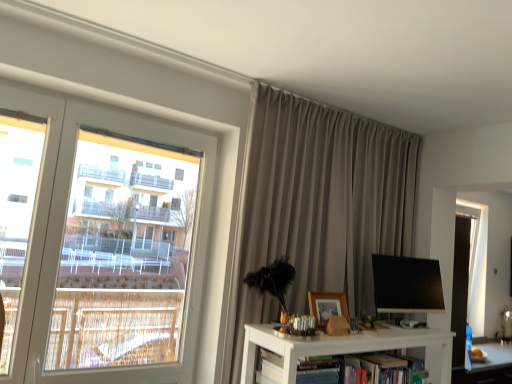
Question: Is matte gray curtain at upper center next to black glossy monitor at center and touching it?

Choices:
 (A) yes
 (B) no

Answer: (B)

Question: From a real-world perspective, does matte gray curtain at upper center sit lower than black glossy monitor at center?

Choices:
 (A) no
 (B) yes

Answer: (A)

Question: Would you say matte gray curtain at upper center is outside black glossy monitor at center?

Choices:
 (A) yes
 (B) no

Answer: (A)

Question: Considering the relative sizes of matte gray curtain at upper center and black glossy monitor at center in the image provided, is matte gray curtain at upper center taller than black glossy monitor at center?

Choices:
 (A) yes
 (B) no

Answer: (A)

Question: From a real-world perspective, does matte gray curtain at upper center stand above black glossy monitor at center?

Choices:
 (A) no
 (B) yes

Answer: (B)

Question: In terms of width, does hardcover book at center look wider or thinner when compared to wooden picture frame at center?

Choices:
 (A) thin
 (B) wide

Answer: (B)

Question: Would you say hardcover book at center is to the left or to the right of wooden picture frame at center in the picture?

Choices:
 (A) left
 (B) right

Answer: (B)

Question: Is hardcover book at center taller or shorter than wooden picture frame at center?

Choices:
 (A) short
 (B) tall

Answer: (B)

Question: Considering the positions of hardcover book at center and wooden picture frame at center in the image, is hardcover book at center bigger or smaller than wooden picture frame at center?

Choices:
 (A) big
 (B) small

Answer: (A)

Question: From the image's perspective, relative to hardcover book at center, is matte gray curtain at upper center above or below?

Choices:
 (A) above
 (B) below

Answer: (A)

Question: Relative to hardcover book at center, is matte gray curtain at upper center in front or behind?

Choices:
 (A) behind
 (B) front

Answer: (A)

Question: Is matte gray curtain at upper center situated inside hardcover book at center or outside?

Choices:
 (A) outside
 (B) inside

Answer: (A)

Question: Based on their sizes in the image, would you say matte gray curtain at upper center is bigger or smaller than hardcover book at center?

Choices:
 (A) big
 (B) small

Answer: (A)

Question: Relative to matte gray curtain at upper center, is black glossy monitor at center in front or behind?

Choices:
 (A) behind
 (B) front

Answer: (A)

Question: From the image's perspective, is black glossy monitor at center positioned above or below matte gray curtain at upper center?

Choices:
 (A) below
 (B) above

Answer: (A)